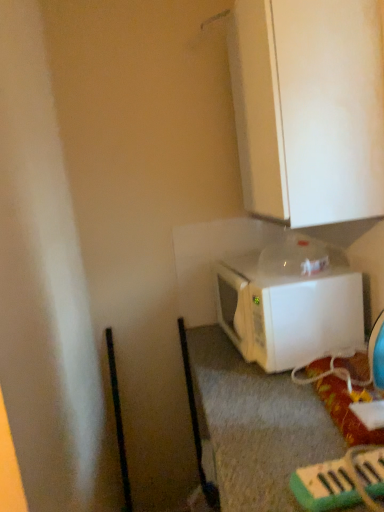
The width and height of the screenshot is (384, 512). Find the location of `vacant space situated above white matte microwave at lower right (from a real-world perspective)`. vacant space situated above white matte microwave at lower right (from a real-world perspective) is located at coordinates (276, 267).